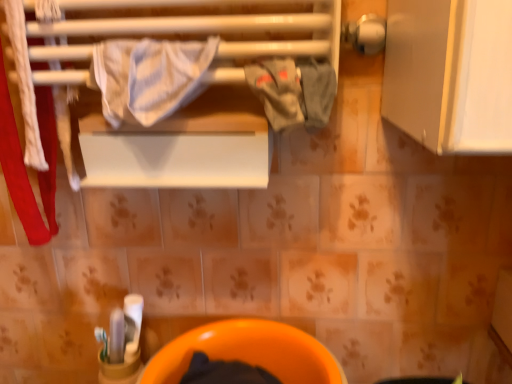
Question: In terms of height, does white striped fabric at upper center look taller or shorter compared to gray cotton cloth at center?

Choices:
 (A) tall
 (B) short

Answer: (A)

Question: Does point (146, 92) appear closer or farther from the camera than point (285, 127)?

Choices:
 (A) closer
 (B) farther

Answer: (A)

Question: Which object is the closest to the gray cotton cloth at center?

Choices:
 (A) orange glossy toilet bowl at lower center
 (B) white striped fabric at upper center

Answer: (B)

Question: Based on their relative distances, which object is farther from the gray cotton cloth at center?

Choices:
 (A) white striped fabric at upper center
 (B) orange glossy toilet bowl at lower center

Answer: (B)